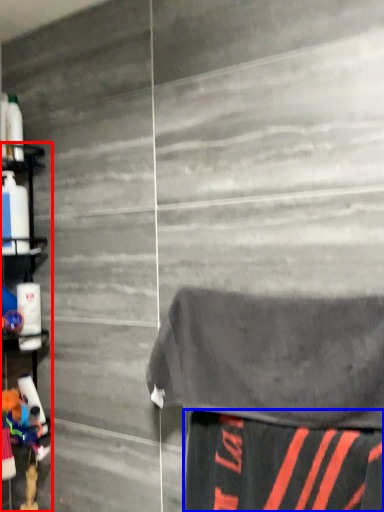
Question: Which of the following is the closest to the observer, shelf (highlighted by a red box) or fabric (highlighted by a blue box)?

Choices:
 (A) shelf
 (B) fabric

Answer: (B)